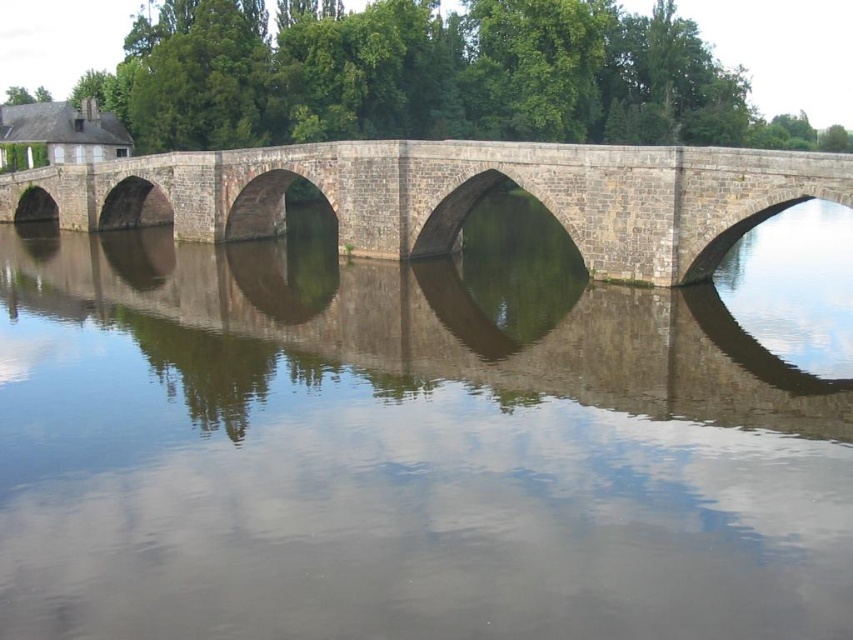
Based on the photo, does smooth gray water at center have a lesser width compared to stone bridge at center?

Yes.

Who is more forward, (631, 616) or (498, 172)?

Point (631, 616) is more forward.

Which is in front, point (36, 540) or point (621, 257)?

Point (36, 540) is more forward.

Find the location of a particular element. smooth gray water at center is located at coordinates (422, 438).